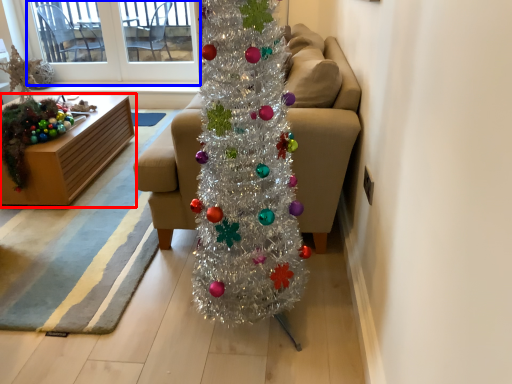
Question: Which object appears farthest to the camera in this image, furniture (highlighted by a red box) or window screen (highlighted by a blue box)?

Choices:
 (A) furniture
 (B) window screen

Answer: (B)